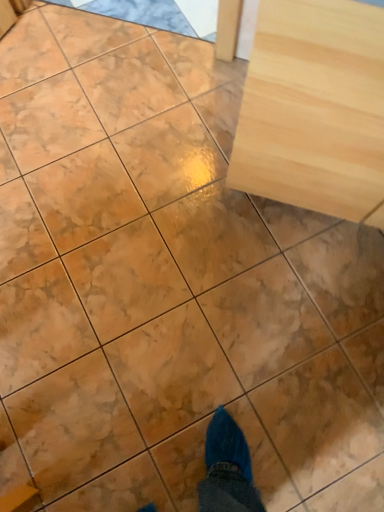
Where is `light wood table at right`? Image resolution: width=384 pixels, height=512 pixels. light wood table at right is located at coordinates (315, 109).

What do you see at coordinates (315, 109) in the screenshot? This screenshot has height=512, width=384. I see `light wood table at right` at bounding box center [315, 109].

What is the approximate height of light wood table at right?

It is 31.02 inches.

Where is `light wood table at right`? The width and height of the screenshot is (384, 512). light wood table at right is located at coordinates (315, 109).